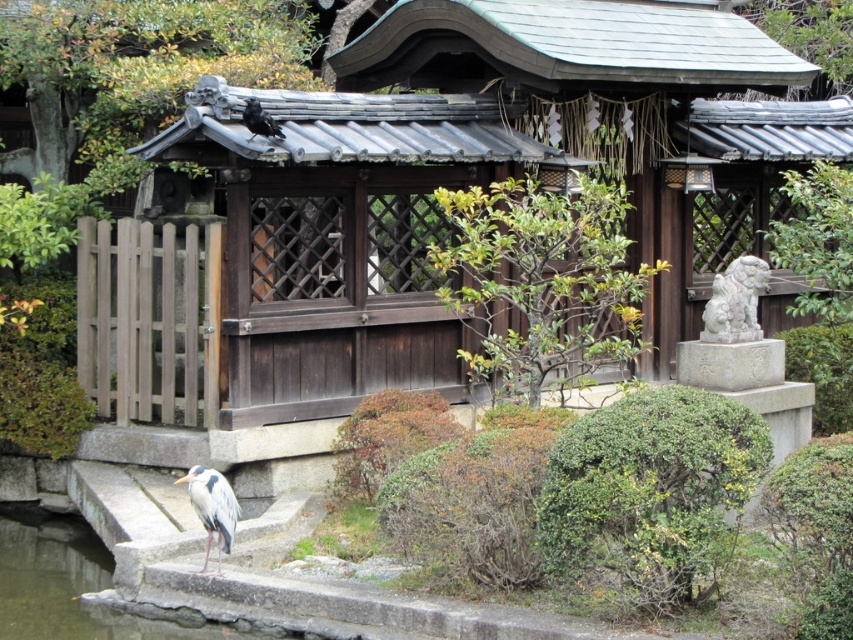
You are a visitor in the Japanese garden and want to take a photo of the white stone lion at right and the shiny black crow at upper center. Which object is taller?

The white stone lion at right is much taller than the shiny black crow at upper center.

Based on the photo, you are standing at the pavilion in the Japanese garden and want to walk to the heron bird. Which point, point (x=223, y=518) or point (x=250, y=124), is closer to your starting position?

Point (x=223, y=518) is closer to the viewer than point (x=250, y=124), so you should head towards point (x=223, y=518) first.